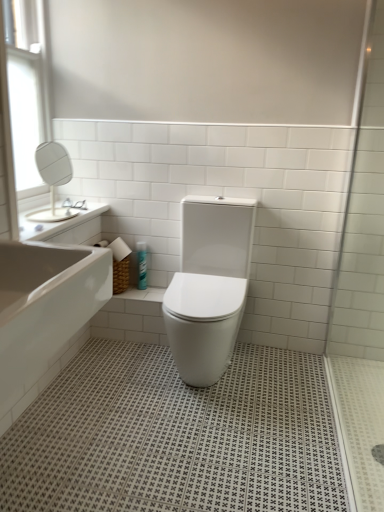
Question: Is white glass window at upper left wider than white glossy toilet at center?

Choices:
 (A) no
 (B) yes

Answer: (A)

Question: Is white glass window at upper left oriented away from white glossy toilet at center?

Choices:
 (A) yes
 (B) no

Answer: (B)

Question: Is white glass window at upper left closer to the viewer compared to white glossy toilet at center?

Choices:
 (A) yes
 (B) no

Answer: (B)

Question: Would you consider white glass window at upper left to be distant from white glossy toilet at center?

Choices:
 (A) no
 (B) yes

Answer: (B)

Question: Considering the relative positions of white glass window at upper left and white glossy toilet at center in the image provided, is white glass window at upper left to the right of white glossy toilet at center from the viewer's perspective?

Choices:
 (A) no
 (B) yes

Answer: (A)

Question: Can you confirm if white glass window at upper left is taller than white glossy toilet at center?

Choices:
 (A) yes
 (B) no

Answer: (A)

Question: Is transparent glass shower door at right positioned beyond the bounds of white glossy toilet at center?

Choices:
 (A) yes
 (B) no

Answer: (A)

Question: Can you confirm if transparent glass shower door at right is bigger than white glossy toilet at center?

Choices:
 (A) no
 (B) yes

Answer: (A)

Question: Can you confirm if transparent glass shower door at right is thinner than white glossy toilet at center?

Choices:
 (A) yes
 (B) no

Answer: (B)

Question: Is transparent glass shower door at right positioned in front of white glossy toilet at center?

Choices:
 (A) no
 (B) yes

Answer: (B)

Question: Does transparent glass shower door at right appear on the left side of white glossy toilet at center?

Choices:
 (A) yes
 (B) no

Answer: (B)

Question: Can you confirm if transparent glass shower door at right is shorter than white glossy toilet at center?

Choices:
 (A) no
 (B) yes

Answer: (A)

Question: Does white glossy sink at upper left have a smaller size compared to white glossy toilet at center?

Choices:
 (A) yes
 (B) no

Answer: (A)